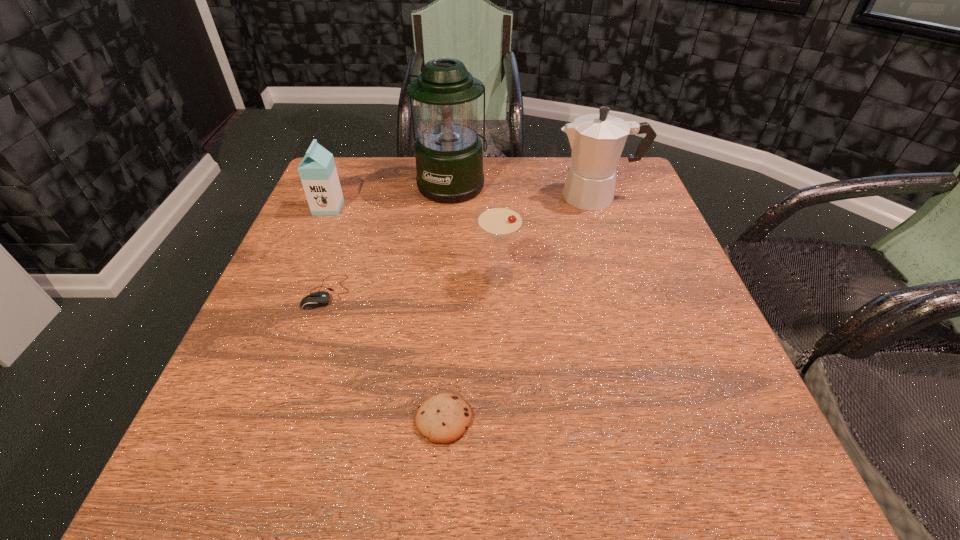
The width and height of the screenshot is (960, 540). In order to click on vacant space at the near right corner of the desktop in this screenshot , I will do `click(776, 492)`.

Locate an element on the screen. Image resolution: width=960 pixels, height=540 pixels. free area in between the nearest object and the computer mouse is located at coordinates (386, 355).

At what (x,y) coordinates should I click in order to perform the action: click on free space between the rightmost object and the martini. Please return your answer as a coordinate pair (x, y). Looking at the image, I should click on (547, 237).

This screenshot has height=540, width=960. In order to click on vacant space that is in between the milk carton and the nearest object in this screenshot , I will do `click(386, 313)`.

Where is `free area in between the milk carton and the rightmost object`? This screenshot has width=960, height=540. free area in between the milk carton and the rightmost object is located at coordinates (462, 202).

Find the location of a particular element. Image resolution: width=960 pixels, height=540 pixels. vacant area that lies between the nearest object and the rightmost object is located at coordinates [519, 308].

Image resolution: width=960 pixels, height=540 pixels. I want to click on vacant region between the martini and the nearest object, so click(470, 348).

At what (x,y) coordinates should I click in order to perform the action: click on unoccupied position between the martini and the lantern. Please return your answer as a coordinate pair (x, y). Looking at the image, I should click on (475, 230).

Identify the location of vacant area that lies between the coffeepot and the computer mouse. The image size is (960, 540). (462, 244).

I want to click on free space that is in between the lantern and the milk carton, so click(x=391, y=196).